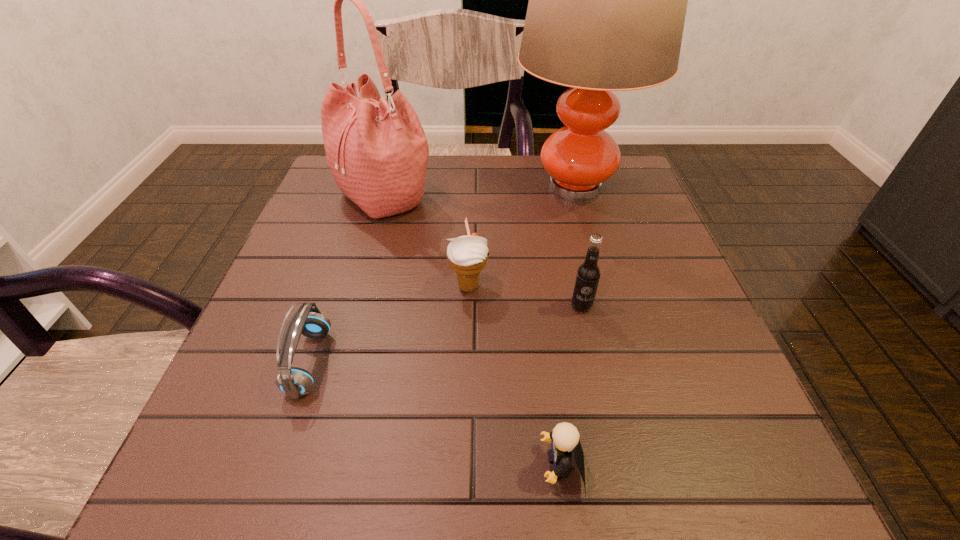
You are a GUI agent. You are given a task and a screenshot of the screen. Output one action in this format:
    pyautogui.click(x=<x>, y=<y>)
    Task: Click on the free space that satisfies the following two spatial constraints: 1. on the back side of the tallest object; 2. on the left side of the handbag
    
    Given the screenshot: What is the action you would take?
    pyautogui.click(x=387, y=186)